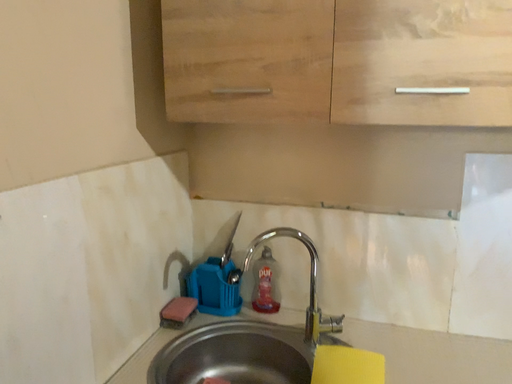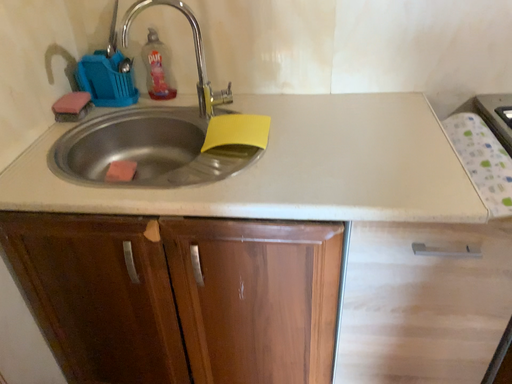
Question: Which way did the camera rotate in the video?

Choices:
 (A) rotated right
 (B) rotated left

Answer: (A)